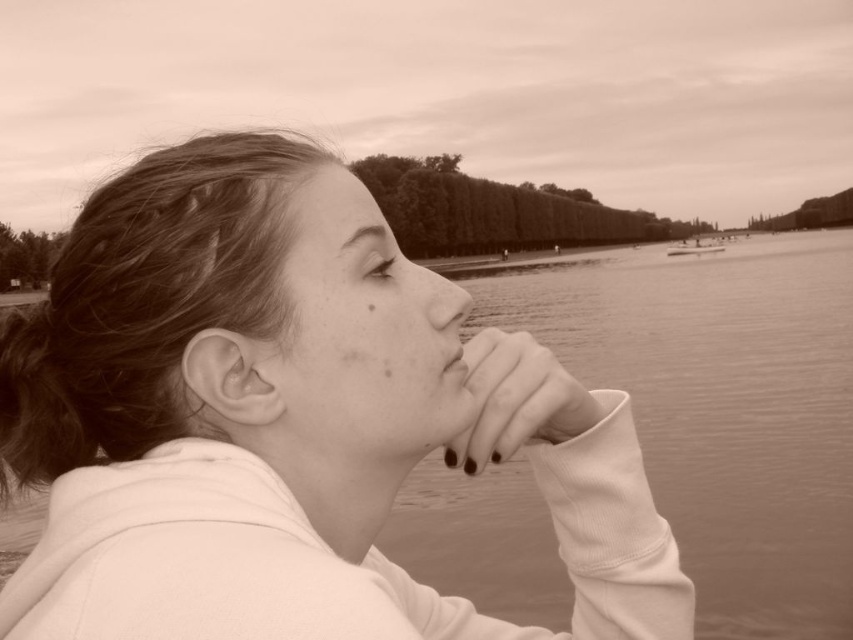
Does matte black nails at center have a greater height compared to smooth skin nose at center?

Correct, matte black nails at center is much taller as smooth skin nose at center.

From the picture: Is matte black nails at center positioned behind smooth skin nose at center?

No, matte black nails at center is in front of smooth skin nose at center.

Who is more forward, (529, 403) or (456, 308)?

Point (529, 403) is more forward.

The width and height of the screenshot is (853, 640). In order to click on matte black nails at center in this screenshot , I will do `click(515, 400)`.

Between matte black nails at center and smooth skin at lower center, which one appears on the left side from the viewer's perspective?

smooth skin at lower center is more to the left.

Does matte black nails at center have a smaller size compared to smooth skin at lower center?

Incorrect, matte black nails at center is not smaller in size than smooth skin at lower center.

Is point (496, 378) more distant than point (456, 369)?

That is False.

Identify the location of matte black nails at center. Image resolution: width=853 pixels, height=640 pixels. (515, 400).

This screenshot has height=640, width=853. What do you see at coordinates (718, 406) in the screenshot?
I see `sepia water at center` at bounding box center [718, 406].

The height and width of the screenshot is (640, 853). Identify the location of sepia water at center. (718, 406).

What are the coordinates of `sepia water at center` in the screenshot? It's located at (718, 406).